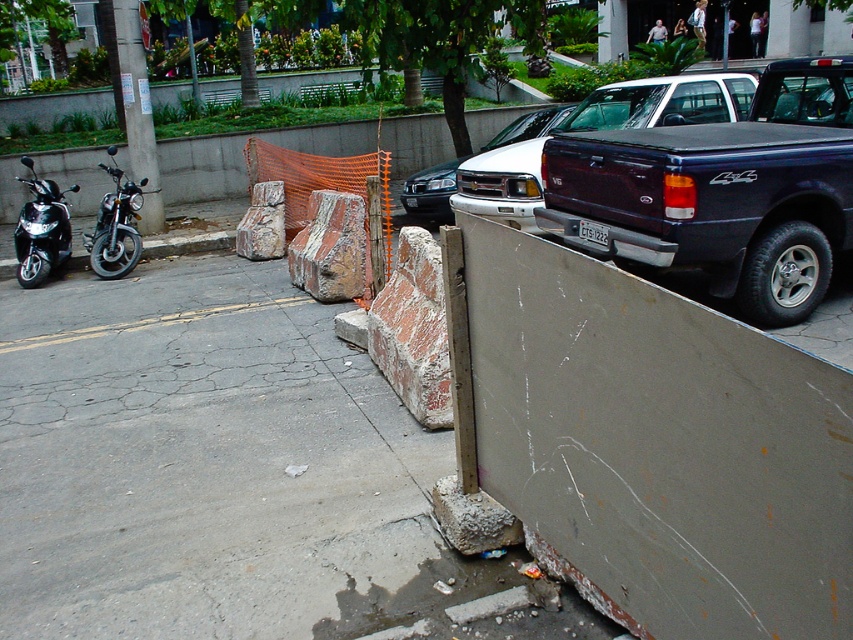
Is concrete wall at center wider than dark purple glossy truck at right?

No.

The image size is (853, 640). What are the coordinates of `concrete wall at center` in the screenshot? It's located at (660, 444).

Locate an element on the screen. The width and height of the screenshot is (853, 640). concrete wall at center is located at coordinates (660, 444).

Does dark purple glossy truck at right appear on the right side of shiny black motorcycle at left?

Indeed, dark purple glossy truck at right is positioned on the right side of shiny black motorcycle at left.

Can you confirm if dark purple glossy truck at right is positioned below shiny black motorcycle at left?

Actually, dark purple glossy truck at right is above shiny black motorcycle at left.

Who is more distant from viewer, (527, 212) or (88, 243)?

Point (88, 243)

This screenshot has width=853, height=640. What are the coordinates of `dark purple glossy truck at right` in the screenshot? It's located at (662, 102).

Does concrete wall at center have a smaller size compared to shiny black motorcycle at left?

Incorrect, concrete wall at center is not smaller in size than shiny black motorcycle at left.

Is point (650, 358) positioned behind point (120, 253)?

That is False.

Locate an element on the screen. Image resolution: width=853 pixels, height=640 pixels. concrete wall at center is located at coordinates (660, 444).